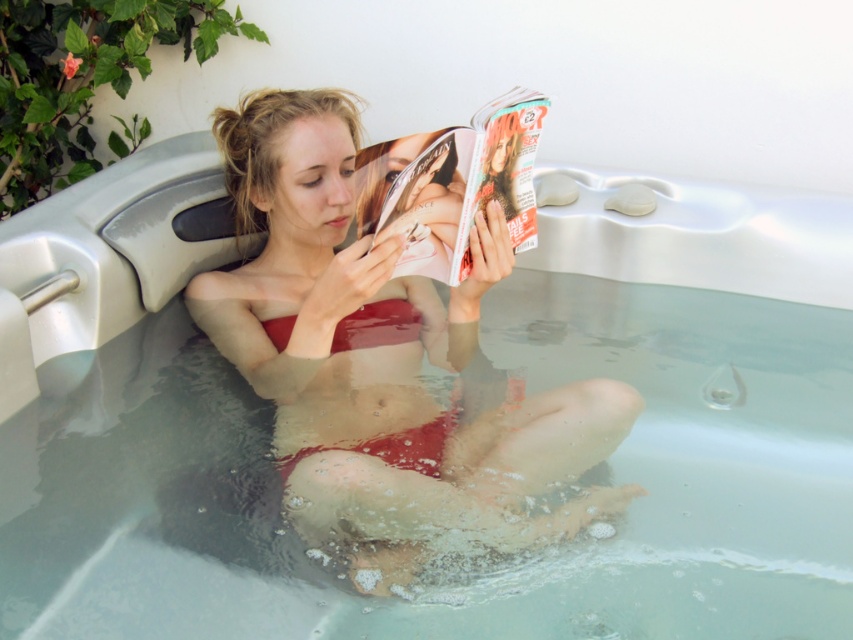
You are a photographer taking a picture of the woman in the hot tub. You notice both the matte red bikini at center and the matte red bikini top at center. Which one is closer to the camera?

The matte red bikini at center is closer to the camera because it is in front of the matte red bikini top at center.

You are designing a swimsuit catalog layout and need to place two red bikinis side by side. The first is the matte red bikini at center and the second is the matte red bikini top at center. Based on their sizes, which one should be placed on the left to ensure proper alignment with the catalog page margins?

The matte red bikini at center should be placed on the left because its width is larger than the matte red bikini top at center, allowing for better alignment with the catalog page margins.

You are a photographer taking a picture of the matte red bikini at center and the matte glossy magazine at center in the hot tub scene. Which object will appear larger in the photo?

The matte red bikini at center will appear larger in the photo because it is much taller than the matte glossy magazine at center.